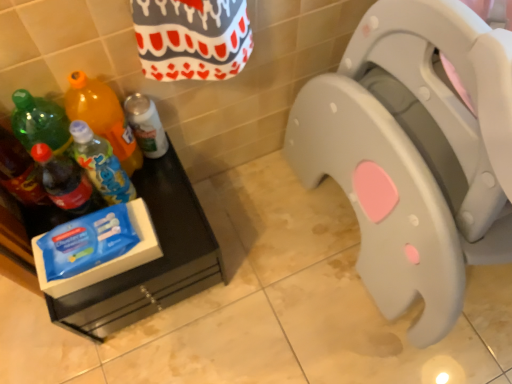
At what (x,y) coordinates should I click in order to perform the action: click on empty space that is to the right of translucent plastic bottle at left, which is the third bottle from left to right. Please return your answer as a coordinate pair (x, y). The height and width of the screenshot is (384, 512). Looking at the image, I should click on (170, 196).